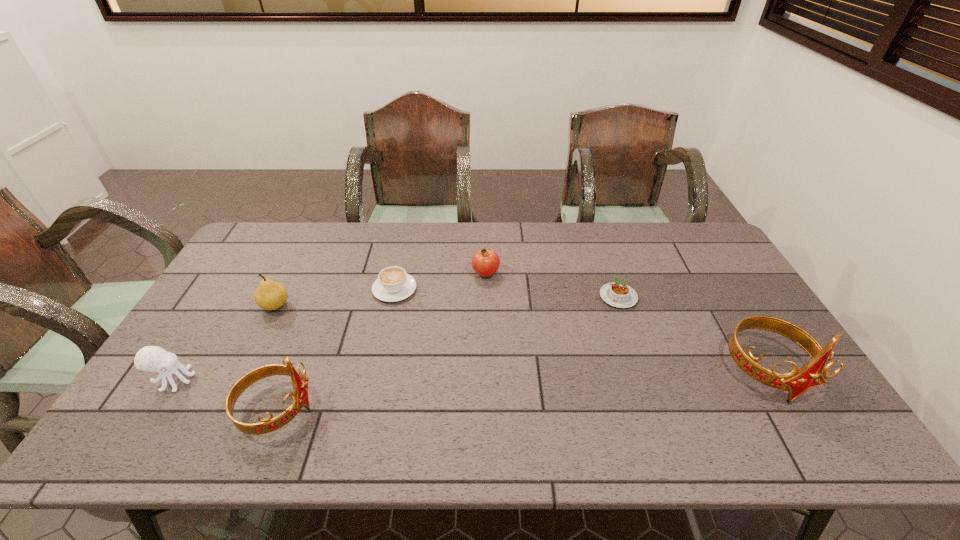
Where is `vacant space at the far right corner of the desktop`? vacant space at the far right corner of the desktop is located at coordinates (678, 252).

You are a GUI agent. You are given a task and a screenshot of the screen. Output one action in this format:
    pyautogui.click(x=<x>, y=<y>)
    Task: Click on the free space between the pear and the rightmost object
    
    Given the screenshot: What is the action you would take?
    pyautogui.click(x=522, y=338)

Where is `free space that is in between the cappuccino and the taller tiara`? This screenshot has width=960, height=540. free space that is in between the cappuccino and the taller tiara is located at coordinates (582, 330).

Locate an element on the screen. empty space between the fifth object from left to right and the octopus is located at coordinates (329, 327).

Where is `unoccupied area between the apple and the tallest object`? The width and height of the screenshot is (960, 540). unoccupied area between the apple and the tallest object is located at coordinates (627, 322).

Find the location of a particular element. The image size is (960, 540). free spot between the shortest object and the tallest object is located at coordinates (693, 334).

You are a GUI agent. You are given a task and a screenshot of the screen. Output one action in this format:
    pyautogui.click(x=<x>, y=<y>)
    Task: Click on the vacant space that is in between the left tiara and the fifth object from left to right
    This screenshot has height=540, width=960.
    Given the screenshot: What is the action you would take?
    pyautogui.click(x=381, y=341)

The image size is (960, 540). I want to click on vacant space that is in between the right tiara and the left tiara, so click(x=523, y=390).

Where is `free spot between the fourth object from left to right and the fifth object from left to right`? free spot between the fourth object from left to right and the fifth object from left to right is located at coordinates (441, 281).

What are the coordinates of `unoccupied area between the octopus and the fifth object from left to right` in the screenshot? It's located at (329, 327).